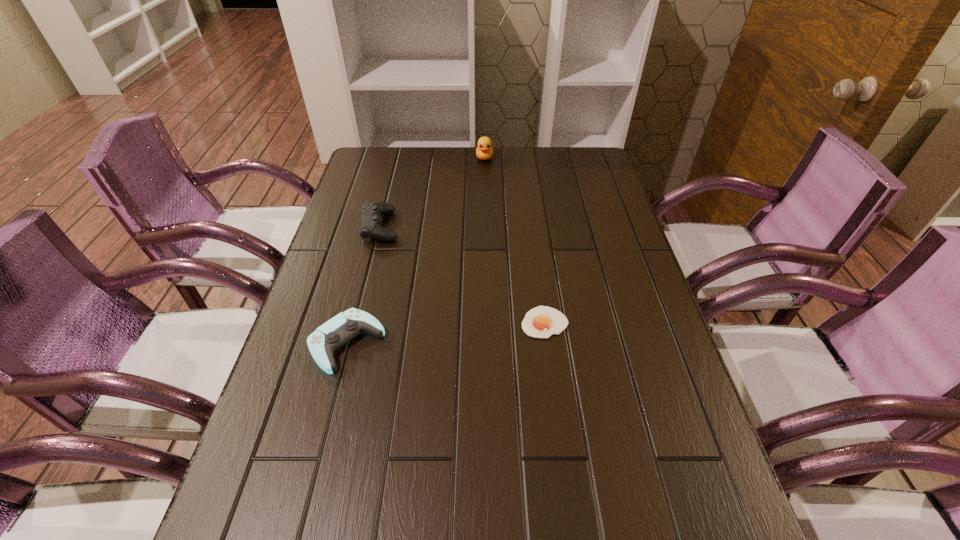
The width and height of the screenshot is (960, 540). Identify the location of the farthest object. (484, 151).

I want to click on the tallest object, so click(x=484, y=151).

Locate an element on the screen. This screenshot has height=540, width=960. the third nearest object is located at coordinates (370, 220).

Where is `the taller control`? the taller control is located at coordinates (370, 220).

Identify the location of the shorter control. (337, 331).

Locate an element on the screen. the third tallest object is located at coordinates [337, 331].

Find the location of a particular element. This screenshot has height=540, width=960. the rightmost object is located at coordinates (542, 322).

Locate an element on the screen. The image size is (960, 540). the shortest object is located at coordinates (542, 322).

This screenshot has width=960, height=540. In order to click on vacant space situated 0.140m on the face of the second object from right to left in this screenshot , I will do `click(485, 186)`.

Find the location of a particular element. The width and height of the screenshot is (960, 540). vacant space located 0.300m on the front of the second tallest object is located at coordinates (354, 328).